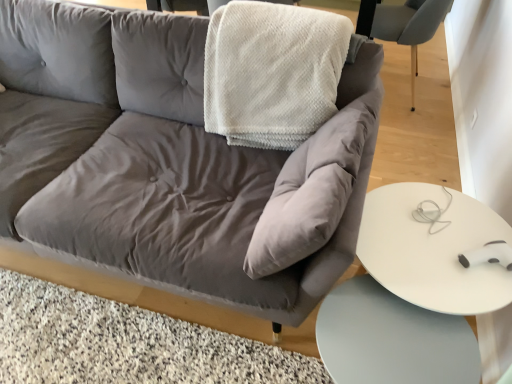
Question: Does white textured blanket at upper center touch white glossy table at lower right, marked as the 1th table in a bottom-to-top arrangement?

Choices:
 (A) no
 (B) yes

Answer: (A)

Question: From a real-world perspective, is white textured blanket at upper center beneath white glossy table at lower right, marked as the 1th table in a bottom-to-top arrangement?

Choices:
 (A) no
 (B) yes

Answer: (A)

Question: From the image's perspective, would you say white textured blanket at upper center is shown under white glossy table at lower right, marked as the 1th table in a bottom-to-top arrangement?

Choices:
 (A) yes
 (B) no

Answer: (B)

Question: Is white textured blanket at upper center to the right of white glossy table at lower right, the second table in the top-to-bottom sequence, from the viewer's perspective?

Choices:
 (A) no
 (B) yes

Answer: (A)

Question: Can you confirm if white textured blanket at upper center is taller than white glossy table at lower right, the second table in the top-to-bottom sequence?

Choices:
 (A) no
 (B) yes

Answer: (B)

Question: Can we say white textured blanket at upper center lies outside white glossy table at lower right, marked as the 1th table in a bottom-to-top arrangement?

Choices:
 (A) no
 (B) yes

Answer: (B)

Question: Is white textured blanket at upper center located within white glossy table at lower right, the second table in the top-to-bottom sequence?

Choices:
 (A) yes
 (B) no

Answer: (B)

Question: Considering the relative sizes of white glossy table at lower right, the second table in the top-to-bottom sequence, and white textured blanket at upper center in the image provided, is white glossy table at lower right, the second table in the top-to-bottom sequence, wider than white textured blanket at upper center?

Choices:
 (A) yes
 (B) no

Answer: (B)

Question: Are white glossy table at lower right, marked as the 1th table in a bottom-to-top arrangement, and white textured blanket at upper center far apart?

Choices:
 (A) no
 (B) yes

Answer: (A)

Question: From a real-world perspective, is white glossy table at lower right, marked as the 1th table in a bottom-to-top arrangement, physically below white textured blanket at upper center?

Choices:
 (A) no
 (B) yes

Answer: (B)

Question: Does white glossy table at lower right, the second table in the top-to-bottom sequence, lie behind white textured blanket at upper center?

Choices:
 (A) no
 (B) yes

Answer: (A)

Question: Are white glossy table at lower right, the second table in the top-to-bottom sequence, and white textured blanket at upper center making contact?

Choices:
 (A) no
 (B) yes

Answer: (A)

Question: Is white textured blanket at upper center thinner than matte gray chair at upper right?

Choices:
 (A) no
 (B) yes

Answer: (A)